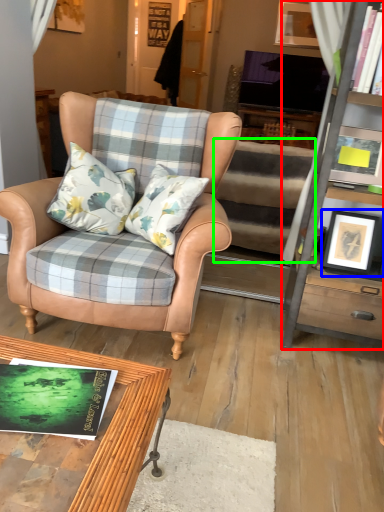
Question: Which object is the farthest from cabinetry (highlighted by a red box)? Choose among these: picture frame (highlighted by a blue box) or stair (highlighted by a green box).

Choices:
 (A) picture frame
 (B) stair

Answer: (B)